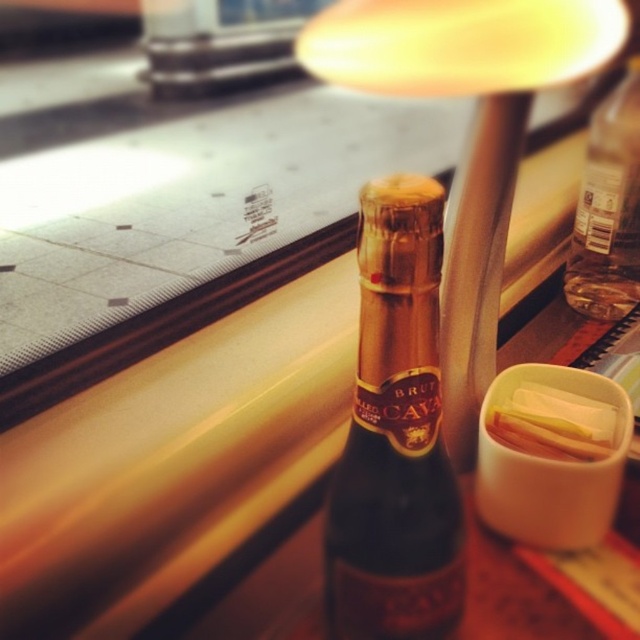
This screenshot has width=640, height=640. What are the coordinates of `dark brown glass bottle at center` in the screenshot? It's located at (396, 435).

Measure the distance between dark brown glass bottle at center and camera.

7.92 inches

Find the location of a particular element. dark brown glass bottle at center is located at coordinates (396, 435).

Looking at this image, how much distance is there between transparent plastic bottle at upper right and translucent plastic container at upper right?

transparent plastic bottle at upper right is 9.21 inches from translucent plastic container at upper right.

Which is above, transparent plastic bottle at upper right or translucent plastic container at upper right?

transparent plastic bottle at upper right is above.

Is point (605, 227) closer to viewer compared to point (515, 435)?

No, it is behind (515, 435).

Identify the location of transparent plastic bottle at upper right. (609, 209).

Is dark brown glass bottle at center thinner than transparent plastic bottle at upper right?

No.

Between dark brown glass bottle at center and transparent plastic bottle at upper right, which one is positioned higher?

transparent plastic bottle at upper right is above.

Locate an element on the screen. This screenshot has width=640, height=640. dark brown glass bottle at center is located at coordinates (396, 435).